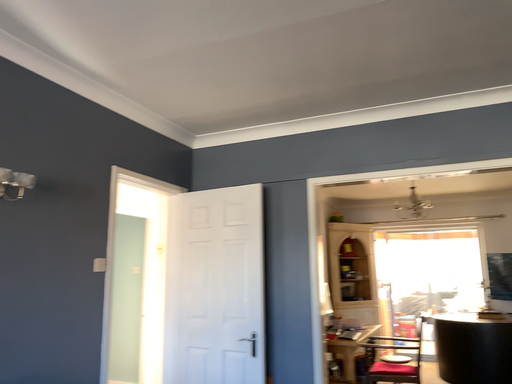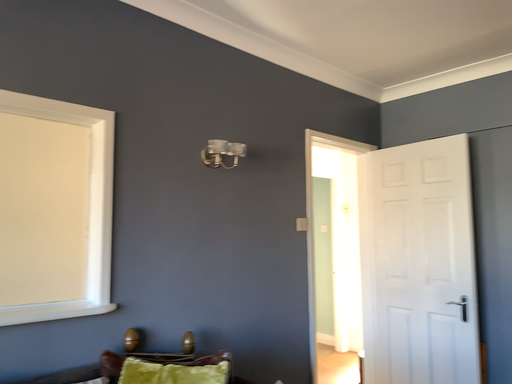
Question: Which way did the camera rotate in the video?

Choices:
 (A) rotated upward
 (B) rotated downward

Answer: (B)